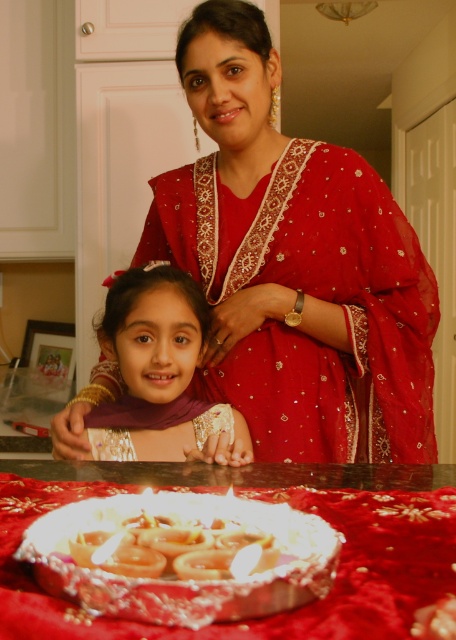
Question: Which point is closer to the camera?

Choices:
 (A) matte red sari at center
 (B) shiny golden rings at center
 (C) purple satin hijab at center

Answer: (B)

Question: Does purple satin hijab at center have a larger size compared to shiny golden rings at center?

Choices:
 (A) no
 (B) yes

Answer: (B)

Question: Can you confirm if purple satin hijab at center is positioned to the right of shiny golden rings at center?

Choices:
 (A) no
 (B) yes

Answer: (A)

Question: Can you confirm if matte red sari at center is wider than shiny golden rings at center?

Choices:
 (A) yes
 (B) no

Answer: (A)

Question: Which object is closer to the camera taking this photo?

Choices:
 (A) metallic silver tray at center
 (B) shiny golden rings at center

Answer: (A)

Question: Which of the following is the closest to the observer?

Choices:
 (A) (356, 371)
 (B) (120, 548)

Answer: (B)